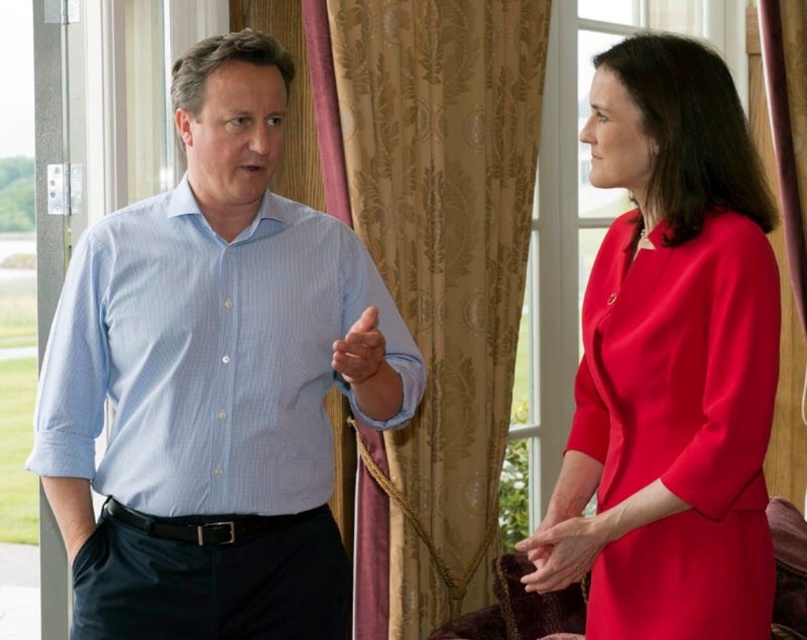
Image resolution: width=807 pixels, height=640 pixels. What are the coordinates of `light blue striped shirt at left` in the screenshot? It's located at (210, 381).

Between point (341, 280) and point (609, 564), which one is positioned behind?

The point (341, 280) is more distant.

What are the coordinates of `light blue striped shirt at left` in the screenshot? It's located at pyautogui.click(x=210, y=381).

Is matte red dress at right above smooth red dress at center?

Indeed, matte red dress at right is positioned over smooth red dress at center.

Describe the element at coordinates (680, 426) in the screenshot. Image resolution: width=807 pixels, height=640 pixels. I see `matte red dress at right` at that location.

Does point (703, 573) lie in front of point (571, 529)?

Yes, point (703, 573) is in front of point (571, 529).

Locate an element on the screen. The image size is (807, 640). matte red dress at right is located at coordinates (680, 426).

Measure the distance from gold textured curtain at center to matte blue shirt at center.

gold textured curtain at center is 38.56 inches from matte blue shirt at center.

Does gold textured curtain at center appear under matte blue shirt at center?

No.

Between point (490, 465) and point (356, 333), which one is positioned behind?

The point (490, 465) is behind.

Find the location of a particular element. The width and height of the screenshot is (807, 640). gold textured curtain at center is located at coordinates (433, 268).